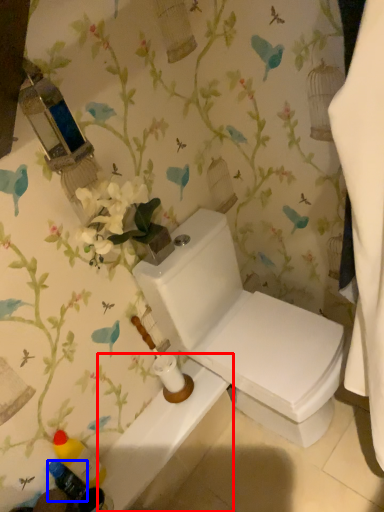
Question: Which point is closer to the camera, bath (highlighted by a red box) or toiletry (highlighted by a blue box)?

Choices:
 (A) bath
 (B) toiletry

Answer: (B)